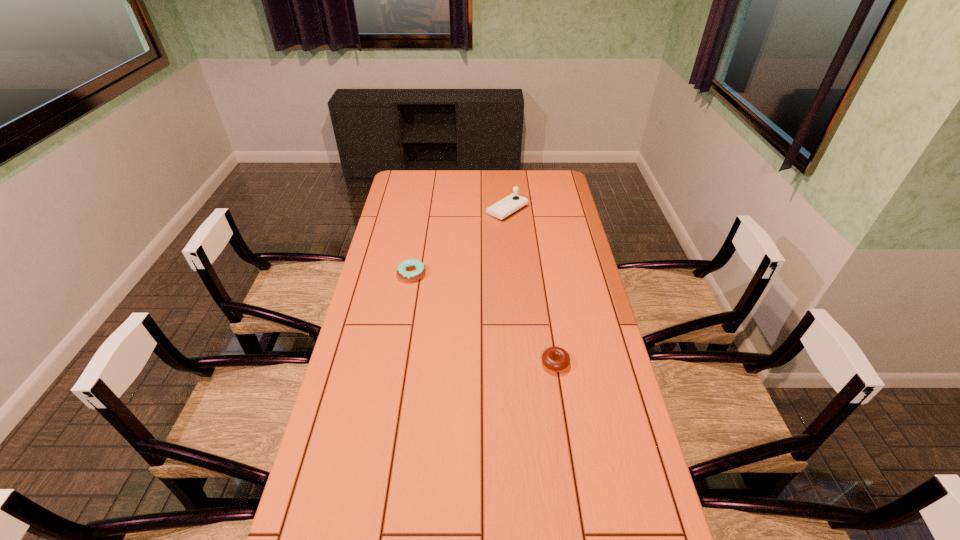
This screenshot has width=960, height=540. I want to click on the closest object to the farthest object, so click(402, 268).

Locate an element on the screen. This screenshot has height=540, width=960. doughnut that stands as the closest to the tallest object is located at coordinates (402, 268).

I want to click on doughnut that is the second closest to the farthest object, so click(x=556, y=359).

In order to click on blank space that satisfies the following two spatial constraints: 1. on the front side of the left doughnut; 2. on the left side of the nearer doughnut in this screenshot , I will do `click(396, 363)`.